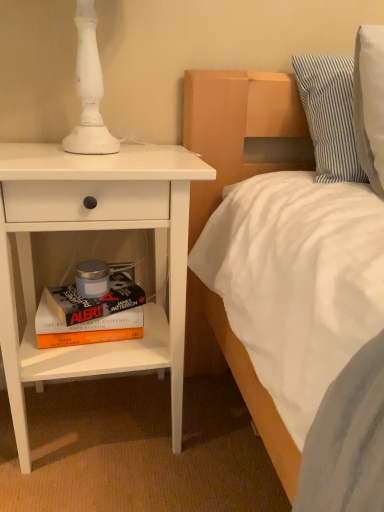
Question: Can you confirm if white matte nightstand at left is shorter than hardcover book at lower left?

Choices:
 (A) no
 (B) yes

Answer: (A)

Question: From the image's perspective, is white matte nightstand at left beneath hardcover book at lower left?

Choices:
 (A) no
 (B) yes

Answer: (A)

Question: Can you confirm if white matte nightstand at left is bigger than hardcover book at lower left?

Choices:
 (A) yes
 (B) no

Answer: (A)

Question: Is white matte nightstand at left to the right of hardcover book at lower left from the viewer's perspective?

Choices:
 (A) yes
 (B) no

Answer: (A)

Question: Is white matte nightstand at left to the left of hardcover book at lower left from the viewer's perspective?

Choices:
 (A) no
 (B) yes

Answer: (A)

Question: Relative to white matte nightstand at left, is blue striped pillow at upper right in front or behind?

Choices:
 (A) behind
 (B) front

Answer: (A)

Question: Is point (309, 130) positioned closer to the camera than point (180, 242)?

Choices:
 (A) farther
 (B) closer

Answer: (A)

Question: From a real-world perspective, is blue striped pillow at upper right above or below white matte nightstand at left?

Choices:
 (A) below
 (B) above

Answer: (B)

Question: Is blue striped pillow at upper right spatially inside white matte nightstand at left, or outside of it?

Choices:
 (A) inside
 (B) outside

Answer: (B)

Question: Based on their sizes in the image, would you say white matte nightstand at left is bigger or smaller than hardcover book at lower left?

Choices:
 (A) big
 (B) small

Answer: (A)

Question: Based on their positions, is white matte nightstand at left located to the left or right of hardcover book at lower left?

Choices:
 (A) left
 (B) right

Answer: (B)

Question: Is white matte nightstand at left taller or shorter than hardcover book at lower left?

Choices:
 (A) short
 (B) tall

Answer: (B)

Question: Is point (150, 354) positioned closer to the camera than point (72, 311)?

Choices:
 (A) farther
 (B) closer

Answer: (A)

Question: Would you say hardcover book at lower left is to the left or to the right of white matte nightstand at left in the picture?

Choices:
 (A) left
 (B) right

Answer: (A)

Question: In terms of height, does hardcover book at lower left look taller or shorter compared to white matte nightstand at left?

Choices:
 (A) tall
 (B) short

Answer: (B)